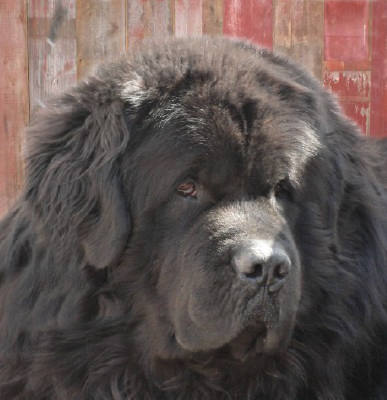
Identify the location of wooden planks. (13, 18), (49, 16), (95, 10), (153, 12), (380, 27), (346, 22), (299, 23), (250, 10), (193, 11).